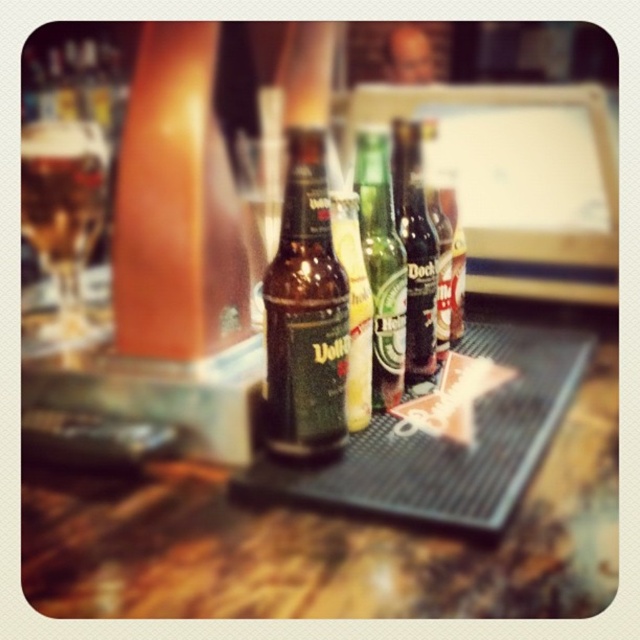
You are a bartender who needs to place a 7.5 inch long cocktail shaker on the bar. You see the black rubber mat at center and the green glass bottle at center. Can you fit the cocktail shaker between them without moving either object?

The black rubber mat at center is 6.88 inches from the green glass bottle at center. Since the cocktail shaker is 7.5 inches long, it cannot fit between them as the distance is shorter than the shaker.